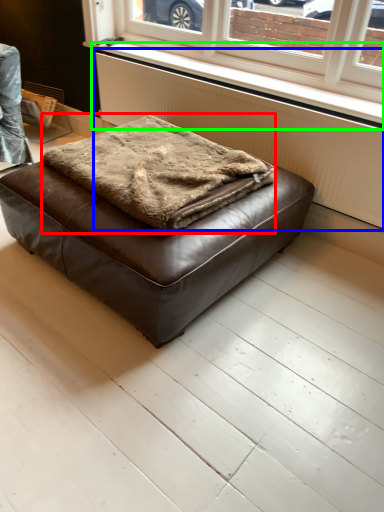
Question: Considering the real-world distances, which object is farthest from blanket (highlighted by a red box)? radiator (highlighted by a blue box) or window sill (highlighted by a green box)?

Choices:
 (A) radiator
 (B) window sill

Answer: (B)